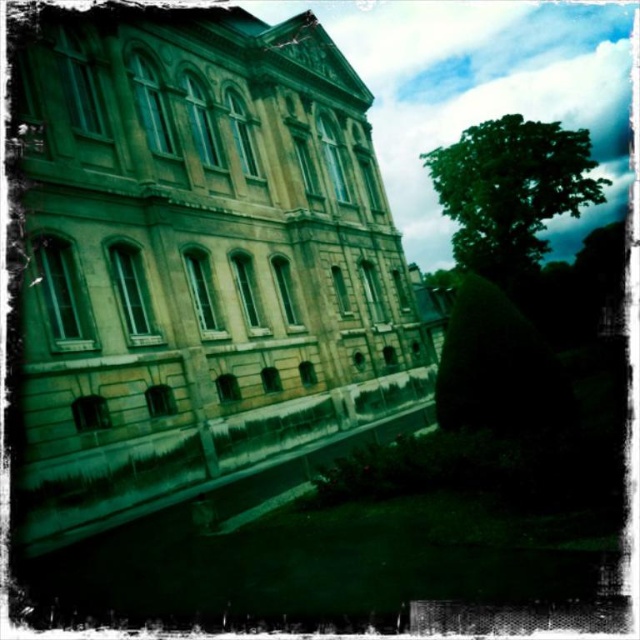
Consider the image. Is stone building at center shorter than green leafy tree at upper right?

Yes.

Is point (212, 362) closer to camera compared to point (451, 145)?

Yes, point (212, 362) is in front of point (451, 145).

The height and width of the screenshot is (640, 640). I want to click on stone building at center, so click(x=196, y=259).